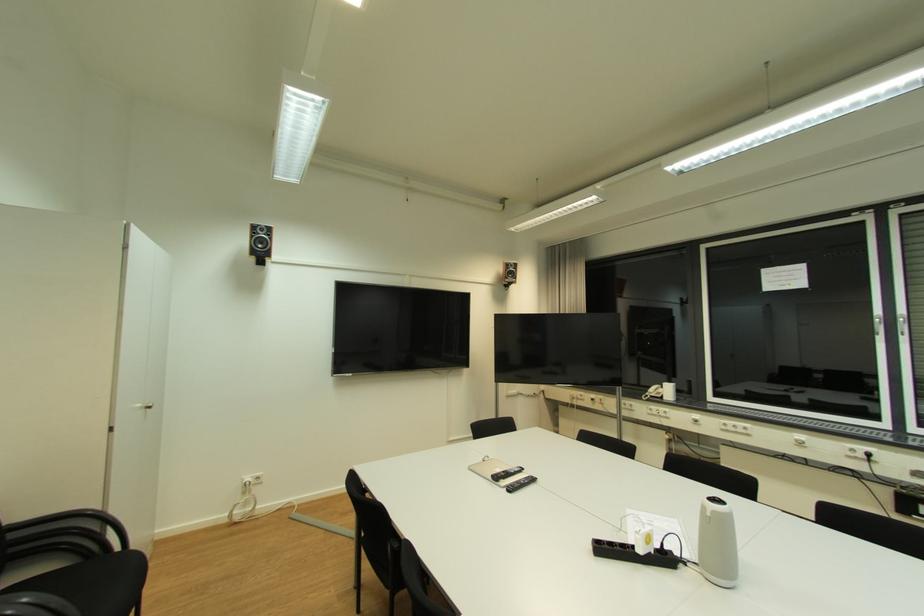
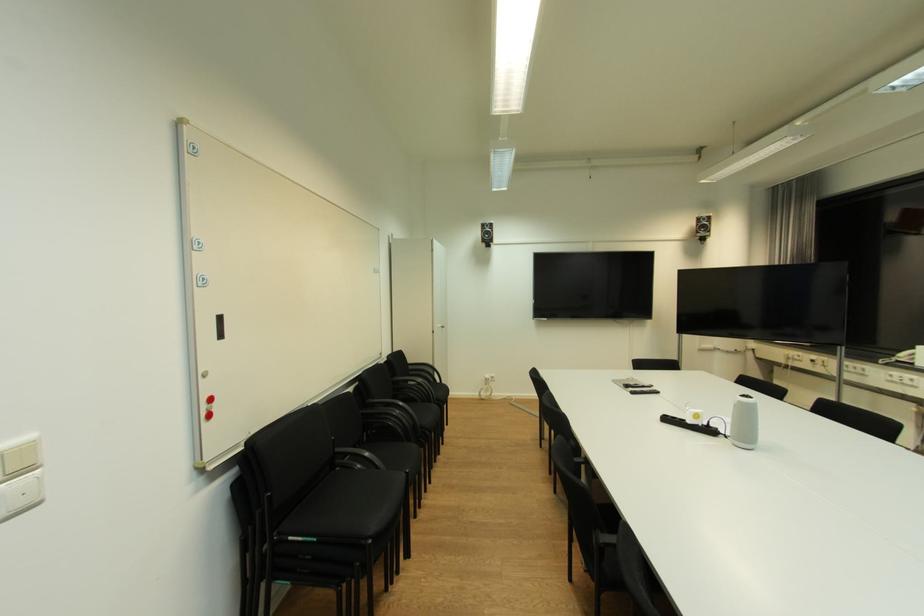
Find the pixel in the second image that matches [516,277] in the first image.

(708, 231)